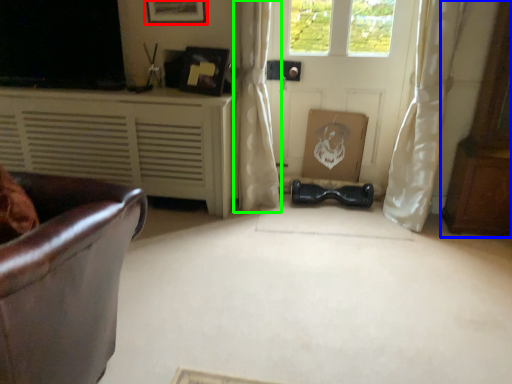
Question: Considering the real-world distances, which object is closest to picture frame (highlighted by a red box)? dresser (highlighted by a blue box) or curtain (highlighted by a green box).

Choices:
 (A) dresser
 (B) curtain

Answer: (B)